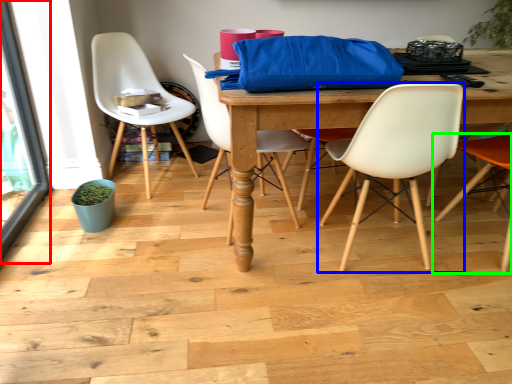
Question: Estimate the real-world distances between objects in this image. Which object is closer to screen door (highlighted by a red box), chair (highlighted by a blue box) or chair (highlighted by a green box)?

Choices:
 (A) chair
 (B) chair

Answer: (A)